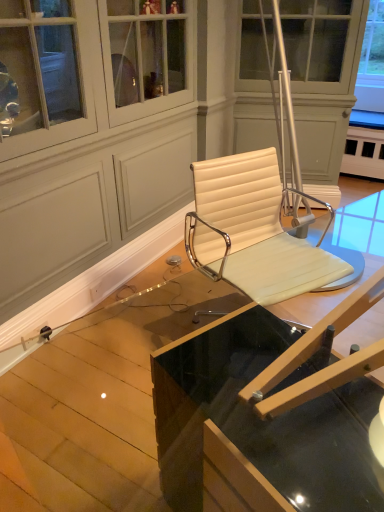
Question: Can you confirm if white leather chair at center is thinner than clear glass table at center, the second table viewed from the back?

Choices:
 (A) yes
 (B) no

Answer: (A)

Question: Is white leather chair at center smaller than clear glass table at center, the second table viewed from the back?

Choices:
 (A) no
 (B) yes

Answer: (B)

Question: Is white leather chair at center not close to clear glass table at center, the second table viewed from the back?

Choices:
 (A) no
 (B) yes

Answer: (A)

Question: Is white leather chair at center further to the viewer compared to clear glass table at center, the second table viewed from the back?

Choices:
 (A) no
 (B) yes

Answer: (B)

Question: Is clear glass table at center, the second table viewed from the back, located within white leather chair at center?

Choices:
 (A) no
 (B) yes

Answer: (A)

Question: From a real-world perspective, is white leather chair at center positioned above or below clear glass table at center, the 1th table viewed from the front?

Choices:
 (A) above
 (B) below

Answer: (A)

Question: Would you say white leather chair at center is to the left or to the right of clear glass table at center, the second table viewed from the back, in the picture?

Choices:
 (A) right
 (B) left

Answer: (B)

Question: From the image's perspective, is white leather chair at center located above or below clear glass table at center, the 1th table viewed from the front?

Choices:
 (A) below
 (B) above

Answer: (B)

Question: Is white leather chair at center spatially inside clear glass table at center, the 1th table viewed from the front, or outside of it?

Choices:
 (A) inside
 (B) outside

Answer: (B)

Question: From the image's perspective, is white leather chair at center located above or below transparent glass table at center, the 2th table when ordered from front to back?

Choices:
 (A) above
 (B) below

Answer: (A)

Question: Considering the positions of point (243, 266) and point (34, 457), is point (243, 266) closer or farther from the camera than point (34, 457)?

Choices:
 (A) closer
 (B) farther

Answer: (B)

Question: Relative to transparent glass table at center, the 2th table when ordered from front to back, is white leather chair at center in front or behind?

Choices:
 (A) behind
 (B) front

Answer: (A)

Question: Considering the positions of white leather chair at center and transparent glass table at center, which is counted as the first table, starting from the back, in the image, is white leather chair at center wider or thinner than transparent glass table at center, which is counted as the first table, starting from the back,?

Choices:
 (A) wide
 (B) thin

Answer: (B)

Question: Choose the correct answer: Is transparent glass table at center, which is counted as the first table, starting from the back, inside clear glass table at center, the second table viewed from the back, or outside it?

Choices:
 (A) inside
 (B) outside

Answer: (B)

Question: From a real-world perspective, is transparent glass table at center, the 2th table when ordered from front to back, physically located above or below clear glass table at center, the 1th table viewed from the front?

Choices:
 (A) above
 (B) below

Answer: (B)